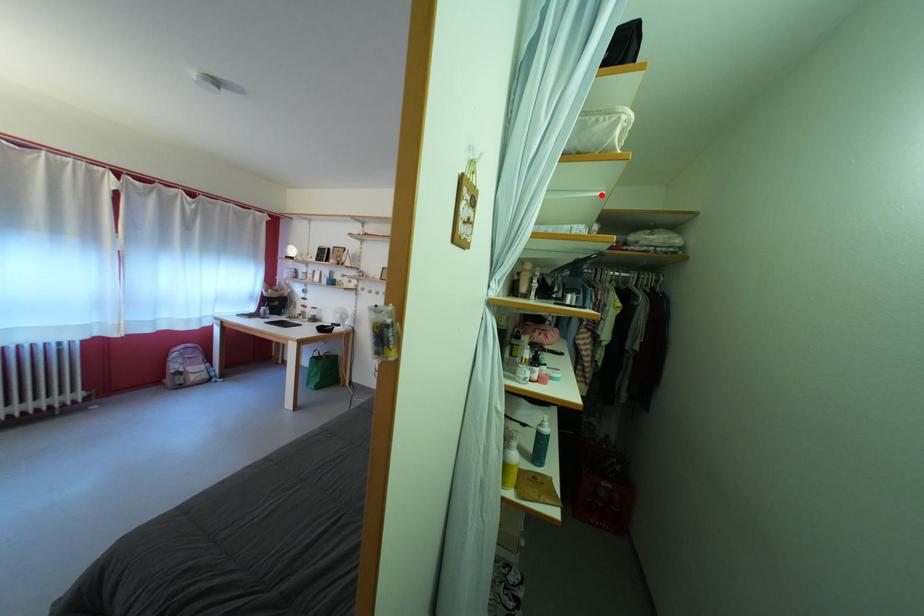
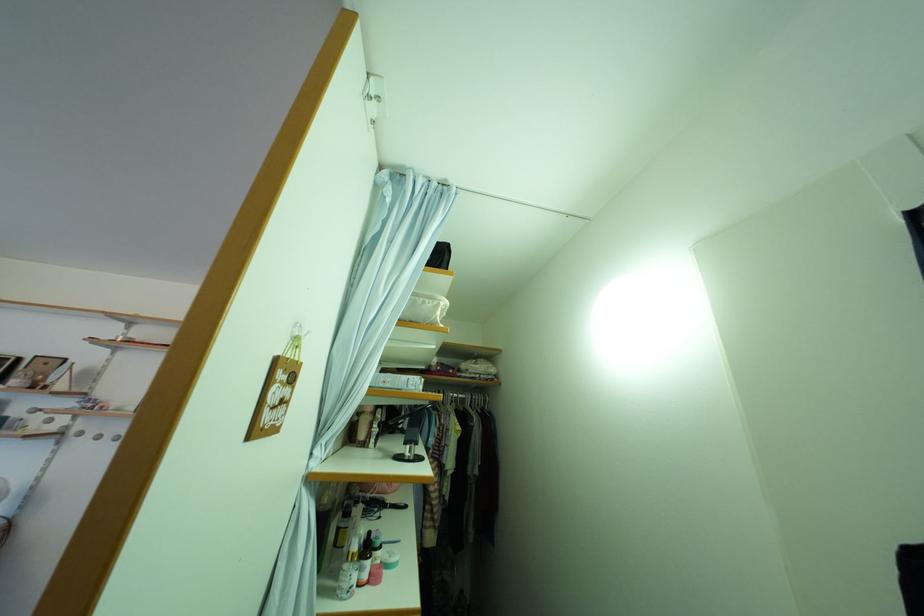
The point at the highlighted location is marked in the first image. Where is the corresponding point in the second image?

(434, 351)